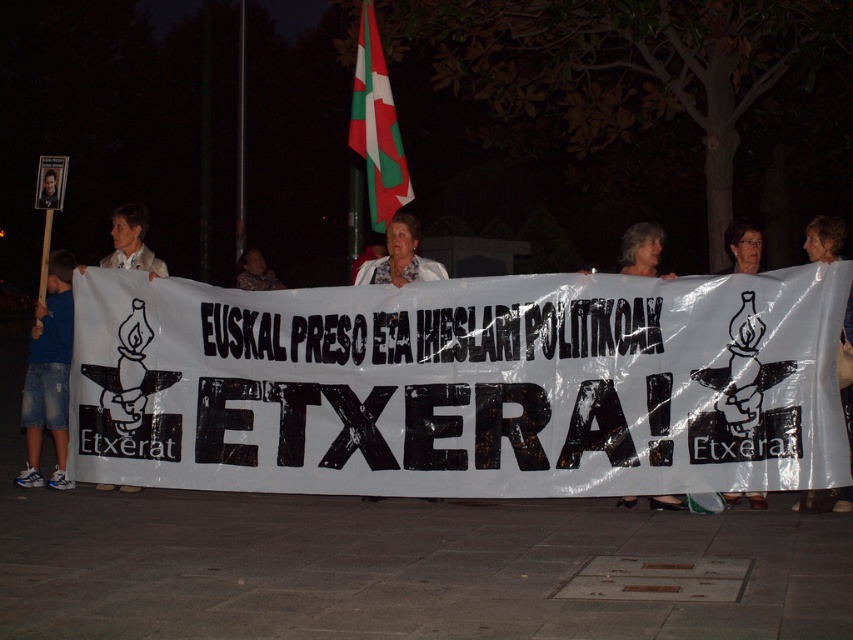
You are organizing a protest and need to decide which item to use as the main display. The scene shows a white fabric at center and a white paper banner at center. Which one is larger in size?

The white fabric at center is bigger than the white paper banner at center, so the white fabric at center is larger and would be suitable for the main display.

You are a photographer trying to capture the banner in the scene. You want to ensure both the white fabric at center and the white fabric at left are visible in your shot. Based on their positions, which fabric should you focus on first to ensure depth of field captures both?

The white fabric at center is closer to the viewer than the white fabric at left. To ensure both are in focus, focus on the white fabric at center first since it is closer, and the depth of field will extend to the farther fabric at left.

You are a photographer trying to capture the white paper banner at center and the smooth plastic sign at upper left in a single shot. Which object should you focus on first to ensure both are in the frame?

You should focus on the white paper banner at center first because it is in front of the smooth plastic sign at upper left, so positioning the camera to include the banner will naturally include the sign behind it as well.